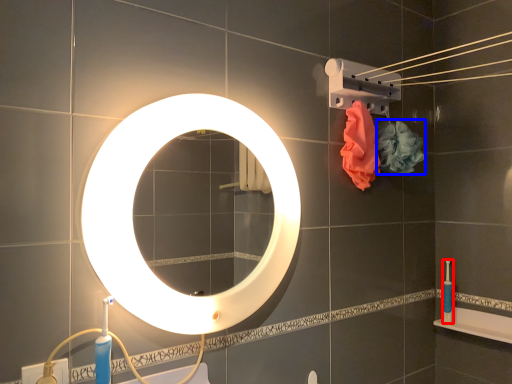
Question: Which object is further to the camera taking this photo, toiletry (highlighted by a red box) or flower (highlighted by a blue box)?

Choices:
 (A) toiletry
 (B) flower

Answer: (A)